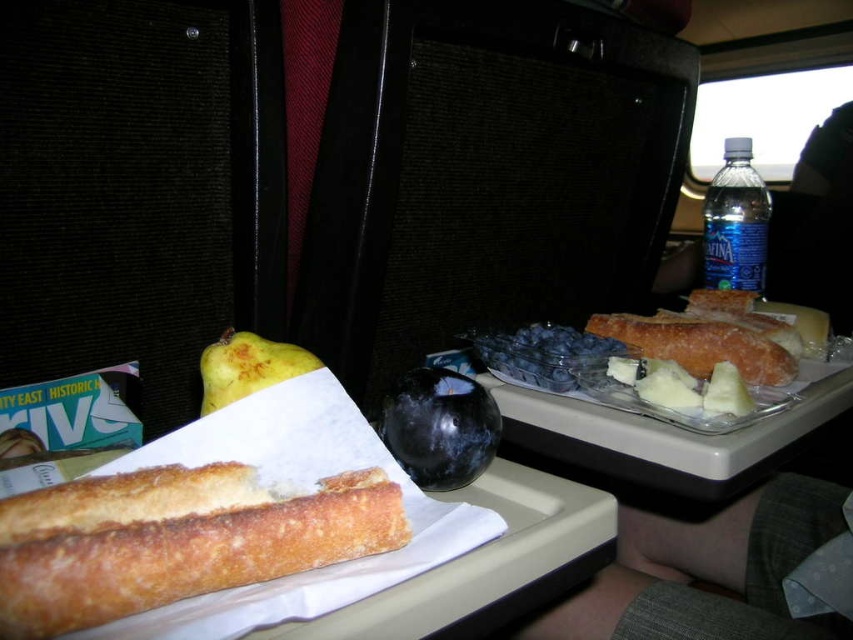
Question: Which point is closer to the camera taking this photo?

Choices:
 (A) pos(749,461)
 (B) pos(276,564)
 (C) pos(751,384)

Answer: (B)

Question: Is slightly toasted bread at center bigger than blue plastic bottle at upper right?

Choices:
 (A) no
 (B) yes

Answer: (A)

Question: Is clear plastic tray at center positioned behind shiny black plum at center?

Choices:
 (A) no
 (B) yes

Answer: (B)

Question: From the image, what is the correct spatial relationship of blue plastic bottle at upper right in relation to yellow matte quince at center?

Choices:
 (A) left
 (B) right

Answer: (B)

Question: Among these objects, which one is nearest to the camera?

Choices:
 (A) slightly toasted bread at center
 (B) blue plastic bottle at upper right
 (C) shiny black plum at center
 (D) yellow matte quince at center

Answer: (C)

Question: Which of the following is the farthest from the observer?

Choices:
 (A) golden brown crusty baguette at lower left
 (B) clear plastic tray at center
 (C) blue plastic bottle at upper right
 (D) shiny black plum at center

Answer: (C)